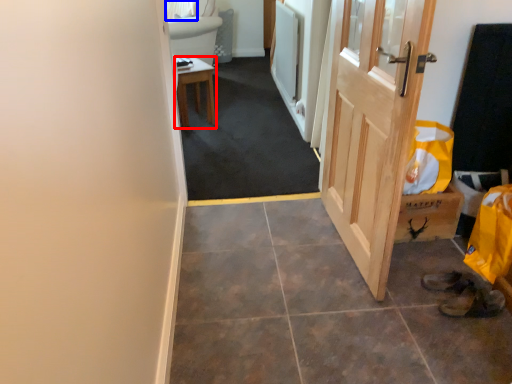
Question: Which object is closer to the camera taking this photo, furniture (highlighted by a red box) or curtain (highlighted by a blue box)?

Choices:
 (A) furniture
 (B) curtain

Answer: (A)